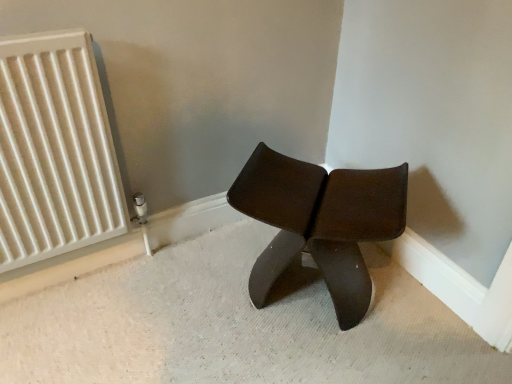
Question: Would you consider white matte radiator at left to be distant from matte brown stool at center?

Choices:
 (A) yes
 (B) no

Answer: (B)

Question: Considering the relative positions of white matte radiator at left and matte brown stool at center in the image provided, is white matte radiator at left in front of matte brown stool at center?

Choices:
 (A) yes
 (B) no

Answer: (A)

Question: Is white matte radiator at left turned away from matte brown stool at center?

Choices:
 (A) no
 (B) yes

Answer: (A)

Question: Does white matte radiator at left lie behind matte brown stool at center?

Choices:
 (A) no
 (B) yes

Answer: (A)

Question: Is white matte radiator at left next to matte brown stool at center?

Choices:
 (A) no
 (B) yes

Answer: (A)

Question: Can you confirm if white matte radiator at left is smaller than matte brown stool at center?

Choices:
 (A) yes
 (B) no

Answer: (A)

Question: Can you confirm if matte brown stool at center is positioned to the right of white matte radiator at left?

Choices:
 (A) yes
 (B) no

Answer: (A)

Question: Is matte brown stool at center positioned behind white matte radiator at left?

Choices:
 (A) no
 (B) yes

Answer: (B)

Question: Are matte brown stool at center and white matte radiator at left far apart?

Choices:
 (A) yes
 (B) no

Answer: (B)

Question: Considering the relative sizes of matte brown stool at center and white matte radiator at left in the image provided, is matte brown stool at center thinner than white matte radiator at left?

Choices:
 (A) no
 (B) yes

Answer: (A)

Question: Is matte brown stool at center not inside white matte radiator at left?

Choices:
 (A) yes
 (B) no

Answer: (A)

Question: Could you tell me if matte brown stool at center is turned towards white matte radiator at left?

Choices:
 (A) yes
 (B) no

Answer: (B)

Question: Considering the positions of white matte radiator at left and matte brown stool at center in the image, is white matte radiator at left bigger or smaller than matte brown stool at center?

Choices:
 (A) small
 (B) big

Answer: (A)